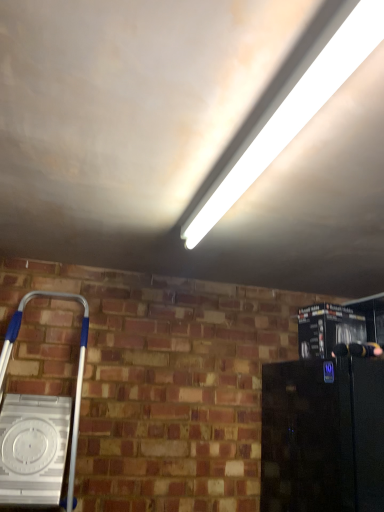
Question: Is white fluorescent tube at upper center surrounded by silver metallic ladder at lower left?

Choices:
 (A) no
 (B) yes

Answer: (A)

Question: Considering the relative sizes of silver metallic ladder at lower left and white fluorescent tube at upper center in the image provided, is silver metallic ladder at lower left thinner than white fluorescent tube at upper center?

Choices:
 (A) yes
 (B) no

Answer: (B)

Question: Is silver metallic ladder at lower left looking in the opposite direction of white fluorescent tube at upper center?

Choices:
 (A) yes
 (B) no

Answer: (B)

Question: Is silver metallic ladder at lower left touching white fluorescent tube at upper center?

Choices:
 (A) yes
 (B) no

Answer: (B)

Question: Is silver metallic ladder at lower left to the right of white fluorescent tube at upper center from the viewer's perspective?

Choices:
 (A) no
 (B) yes

Answer: (A)

Question: Is silver metallic ladder at lower left taller than white fluorescent tube at upper center?

Choices:
 (A) yes
 (B) no

Answer: (A)

Question: Considering the relative sizes of metallic black coffee maker at right, the first appliance when ordered from top to bottom, and black glossy refrigerator at lower right, placed as the 2th appliance when sorted from top to bottom, in the image provided, is metallic black coffee maker at right, the first appliance when ordered from top to bottom, taller than black glossy refrigerator at lower right, placed as the 2th appliance when sorted from top to bottom,?

Choices:
 (A) yes
 (B) no

Answer: (B)

Question: Could you tell me if metallic black coffee maker at right, the first appliance when ordered from top to bottom, is turned towards black glossy refrigerator at lower right, placed as the 2th appliance when sorted from top to bottom?

Choices:
 (A) yes
 (B) no

Answer: (B)

Question: Is metallic black coffee maker at right, the first appliance when ordered from top to bottom, at the left side of black glossy refrigerator at lower right, which is the first appliance in bottom-to-top order?

Choices:
 (A) yes
 (B) no

Answer: (A)

Question: From the image's perspective, would you say metallic black coffee maker at right, the 2th appliance from the bottom, is positioned over black glossy refrigerator at lower right, placed as the 2th appliance when sorted from top to bottom?

Choices:
 (A) no
 (B) yes

Answer: (B)

Question: Is metallic black coffee maker at right, the first appliance when ordered from top to bottom, shorter than black glossy refrigerator at lower right, placed as the 2th appliance when sorted from top to bottom?

Choices:
 (A) yes
 (B) no

Answer: (A)

Question: Is metallic black coffee maker at right, the 2th appliance from the bottom, at the right side of black glossy refrigerator at lower right, placed as the 2th appliance when sorted from top to bottom?

Choices:
 (A) yes
 (B) no

Answer: (B)

Question: Is the depth of white fluorescent tube at upper center less than that of metallic black coffee maker at right, the first appliance when ordered from top to bottom?

Choices:
 (A) no
 (B) yes

Answer: (B)